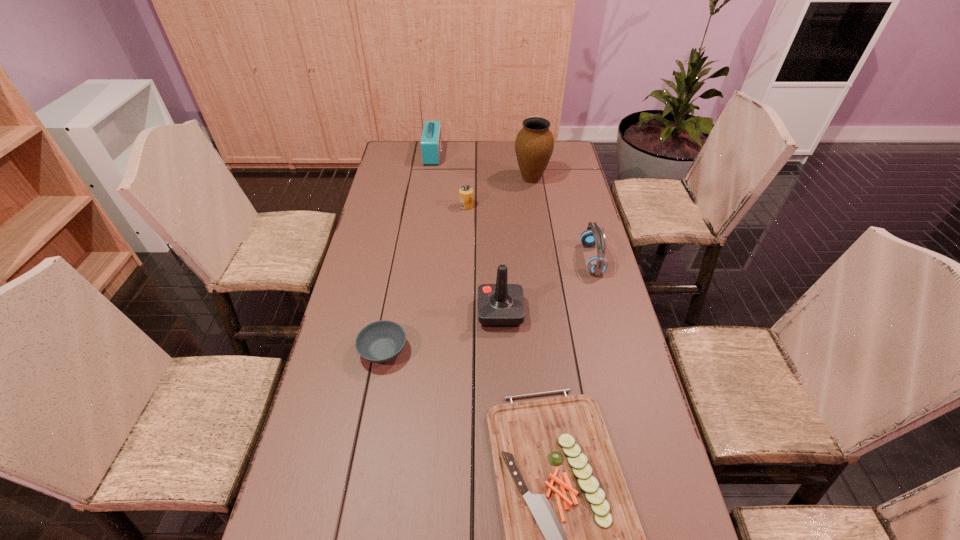
Locate an element on the screen. the farthest object is located at coordinates (431, 141).

In order to click on the tallest object in this screenshot , I will do (431, 141).

Where is `urn`? urn is located at coordinates (534, 144).

At what (x,y) coordinates should I click in order to perform the action: click on the second tallest object. Please return your answer as a coordinate pair (x, y). This screenshot has height=540, width=960. Looking at the image, I should click on coord(534,144).

Where is `the third nearest object`? Image resolution: width=960 pixels, height=540 pixels. the third nearest object is located at coordinates coord(499,305).

I want to click on the fifth shortest object, so click(499, 305).

The image size is (960, 540). In order to click on the fourth nearest object in this screenshot , I will do `click(593, 235)`.

You are a GUI agent. You are given a task and a screenshot of the screen. Output one action in this format:
    pyautogui.click(x=<x>, y=<y>)
    Task: Click on the headset
    The width and height of the screenshot is (960, 540).
    Given the screenshot: What is the action you would take?
    pyautogui.click(x=593, y=235)

I want to click on the fifth object from right to left, so click(465, 192).

Locate an element on the screen. The image size is (960, 540). the third farthest object is located at coordinates (465, 192).